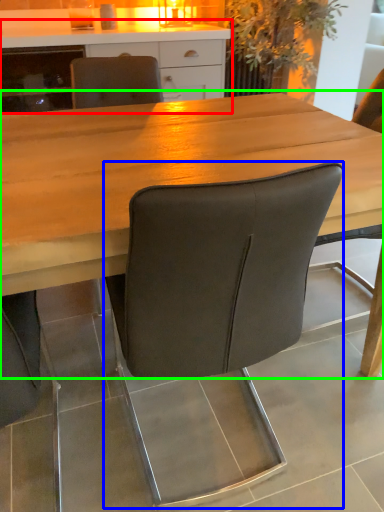
Question: Which object is positioned farthest from cabinetry (highlighted by a red box)? Select from chair (highlighted by a blue box) and table (highlighted by a green box).

Choices:
 (A) chair
 (B) table

Answer: (A)